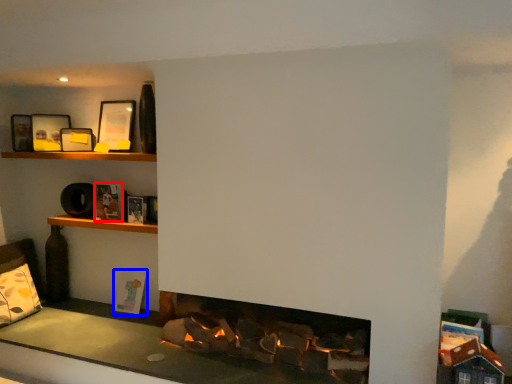
Question: Which point is further to the camera, book (highlighted by a red box) or book (highlighted by a blue box)?

Choices:
 (A) book
 (B) book

Answer: (B)